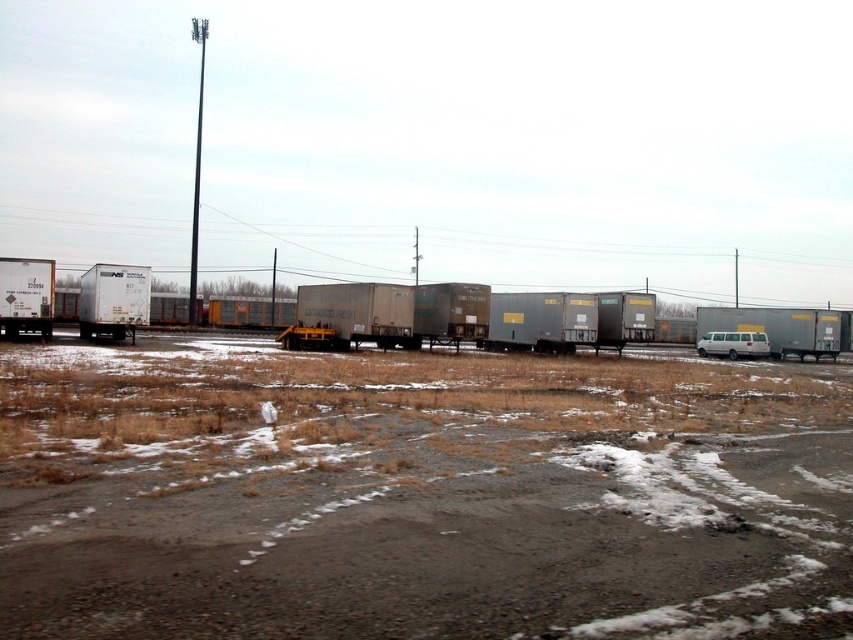
You are a delivery driver who needs to back up your truck to the loading dock. You see the gray matte freight car at center and the white matte trailer truck at left. Which vehicle should you avoid backing into because it is positioned lower?

The gray matte freight car at center is located below the white matte trailer truck at left, so you should avoid backing into the gray matte freight car at center since it is positioned lower and might be more vulnerable to damage during backing maneuvers.

Please provide the coordinates of the gray matte freight car at center in the image. The coordinates should be in the format of a tuple with two decimal numbers, like this example format of the answer would be like this format of the answer would be like this format of the answer would be like this format of the answer would be like this format of the answer would be like this format of the answer would be like this format of the answer would be like this format of the answer would be like this format of a

The coordinates of the gray matte freight car at center are at point [517,314].